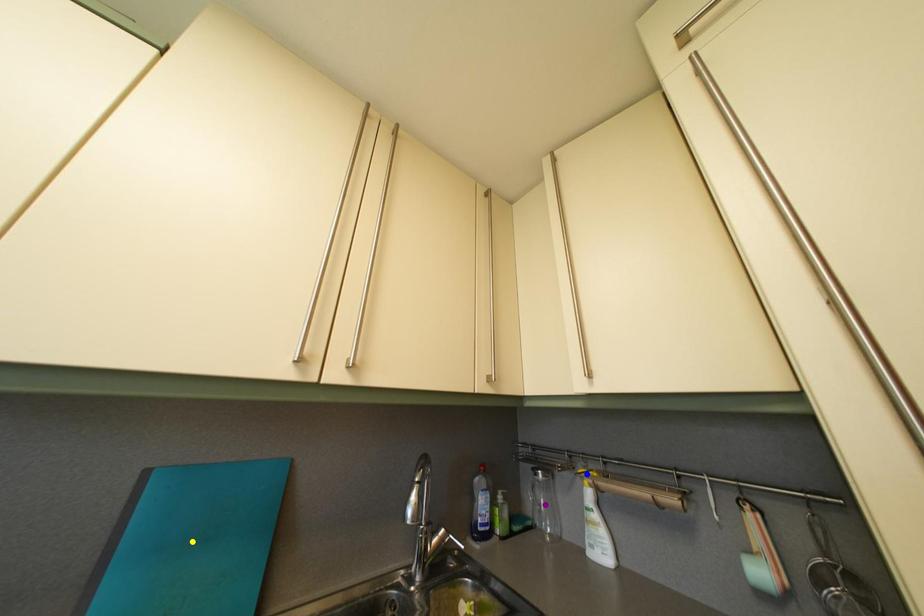
Order these from nearest to farthest:
blue point | purple point | yellow point

yellow point, blue point, purple point